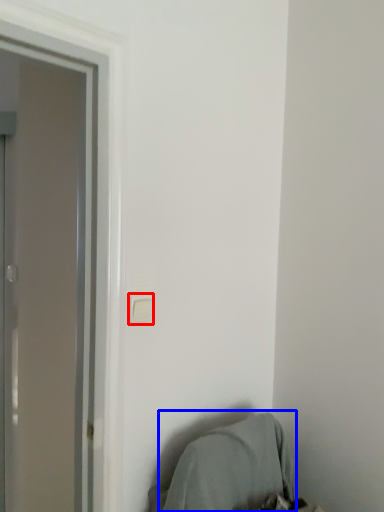
Question: Which point is closer to the camera, light switch (highlighted by a red box) or bean bag chair (highlighted by a blue box)?

Choices:
 (A) light switch
 (B) bean bag chair

Answer: (B)